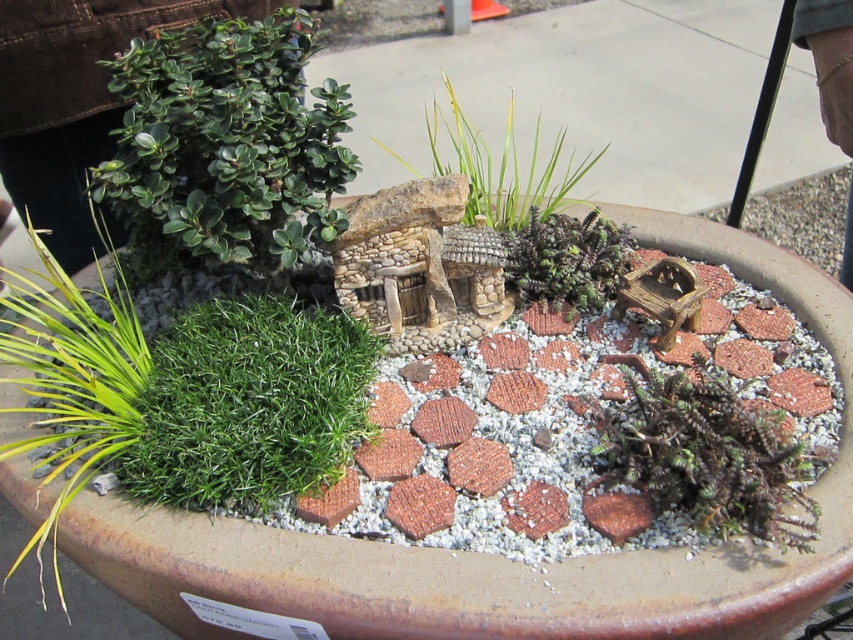
You are a gardener who wants to water the dark green moss at center and the green grass at center. Which one should you water first if you want to avoid getting water on the other?

You should water the dark green moss at center first because it is in front of the green grass at center, so watering it first will prevent water from reaching the green grass at center afterward.

You are designing a miniature garden and want to place a small decorative statue between the rustic stone bird bath at center and the green succulent at center. Which side of the bird bath should you place the statue so it is closer to the succulent?

The statue should be placed on the side of the rustic stone bird bath at center that faces the green succulent at center. Since the bird bath is wider than the succulent, positioning the statue on the narrower side of the bird bath would place it closer to the succulent.

You are a gardener who wants to place a small decorative stone between the dark green moss at center and the green grass at center. Given that the stone is 10 inches wide, will it fit in the space between them?

The distance between the dark green moss at center and the green grass at center is 25.94 inches. Since the stone is only 10 inches wide, it will fit comfortably in the space between them.